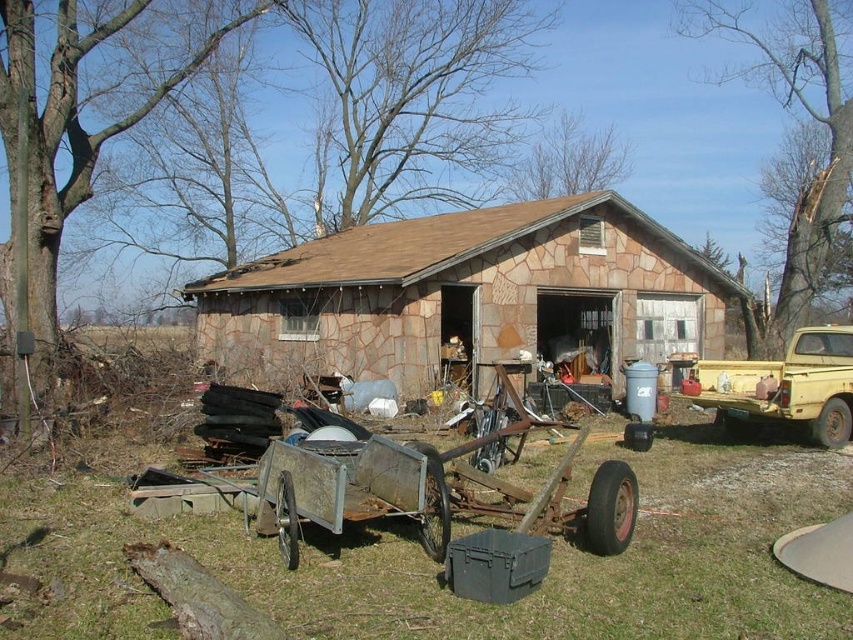
Which is behind, point (759, 554) or point (556, 314)?

Positioned behind is point (556, 314).

Does rusty metal cart at center appear over brown stone hut at center?

Incorrect, rusty metal cart at center is not positioned above brown stone hut at center.

What are the coordinates of `rusty metal cart at center` in the screenshot? It's located at (440, 566).

At what (x,y) coordinates should I click in order to perform the action: click on rusty metal cart at center. Please return your answer as a coordinate pair (x, y). The image size is (853, 640). Looking at the image, I should click on (440, 566).

The image size is (853, 640). What do you see at coordinates (467, 291) in the screenshot?
I see `brown stone hut at center` at bounding box center [467, 291].

Which is above, brown stone hut at center or yellow matte truck at right?

brown stone hut at center is above.

The image size is (853, 640). I want to click on brown stone hut at center, so click(467, 291).

Where is `brown stone hut at center`? Image resolution: width=853 pixels, height=640 pixels. brown stone hut at center is located at coordinates (467, 291).

Is rusty metal cart at center smaller than yellow matte truck at right?

No, rusty metal cart at center is not smaller than yellow matte truck at right.

Where is `rusty metal cart at center`? The width and height of the screenshot is (853, 640). rusty metal cart at center is located at coordinates (440, 566).

Locate an element on the screen. rusty metal cart at center is located at coordinates (440, 566).